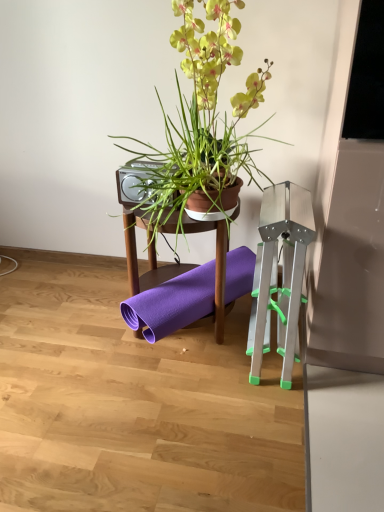
Question: Is silver metallic speaker at upper center turned away from purple rubber yoga mat at center?

Choices:
 (A) yes
 (B) no

Answer: (B)

Question: Is silver metallic speaker at upper center further to the viewer compared to purple rubber yoga mat at center?

Choices:
 (A) yes
 (B) no

Answer: (A)

Question: Is silver metallic speaker at upper center closer to camera compared to purple rubber yoga mat at center?

Choices:
 (A) yes
 (B) no

Answer: (B)

Question: From the image's perspective, would you say silver metallic speaker at upper center is positioned over purple rubber yoga mat at center?

Choices:
 (A) yes
 (B) no

Answer: (A)

Question: Does silver metallic speaker at upper center appear on the left side of purple rubber yoga mat at center?

Choices:
 (A) yes
 (B) no

Answer: (A)

Question: Is silver metallic speaker at upper center beside purple rubber yoga mat at center?

Choices:
 (A) yes
 (B) no

Answer: (B)

Question: Is metallic silver easel at right closer to the viewer compared to green matte plant pot at upper center?

Choices:
 (A) no
 (B) yes

Answer: (A)

Question: Are metallic silver easel at right and green matte plant pot at upper center making contact?

Choices:
 (A) no
 (B) yes

Answer: (A)

Question: Is metallic silver easel at right at the right side of green matte plant pot at upper center?

Choices:
 (A) yes
 (B) no

Answer: (A)

Question: Can you confirm if metallic silver easel at right is taller than green matte plant pot at upper center?

Choices:
 (A) no
 (B) yes

Answer: (B)

Question: From a real-world perspective, is metallic silver easel at right positioned under green matte plant pot at upper center based on gravity?

Choices:
 (A) no
 (B) yes

Answer: (B)

Question: Can you confirm if metallic silver easel at right is positioned to the left of green matte plant pot at upper center?

Choices:
 (A) no
 (B) yes

Answer: (A)

Question: Is metallic silver easel at right behind purple rubber yoga mat at center?

Choices:
 (A) no
 (B) yes

Answer: (A)